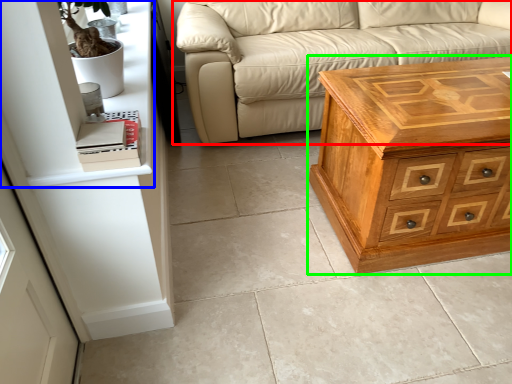
Question: Which is nearer to the studio couch (highlighted by a red box)? shelf (highlighted by a blue box) or chest of drawers (highlighted by a green box).

Choices:
 (A) shelf
 (B) chest of drawers

Answer: (B)